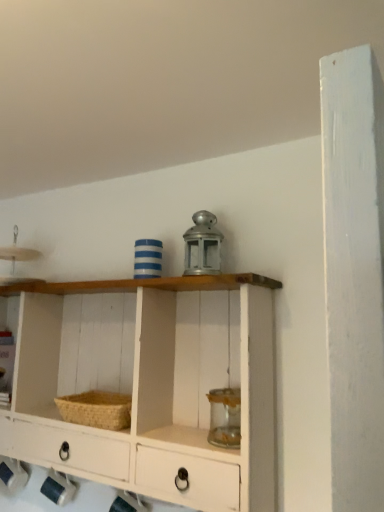
In order to face woven straw basket at lower left, should I rotate leftwards or rightwards?

Rotate left and turn 11.787 degrees.

What is the approximate width of woven straw basket at lower left?

7.54 inches.

This screenshot has height=512, width=384. In order to click on woven straw basket at lower left in this screenshot , I will do `click(97, 409)`.

This screenshot has width=384, height=512. What do you see at coordinates (97, 409) in the screenshot?
I see `woven straw basket at lower left` at bounding box center [97, 409].

What is the approximate height of white painted wood shelf at center?

24.24 inches.

The image size is (384, 512). Describe the element at coordinates (148, 384) in the screenshot. I see `white painted wood shelf at center` at that location.

Find the location of `white painted wood shelf at center`. white painted wood shelf at center is located at coordinates (148, 384).

Where is `woven straw basket at lower left`? woven straw basket at lower left is located at coordinates (97, 409).

Between woven straw basket at lower left and white painted wood shelf at center, which one appears on the left side from the viewer's perspective?

Positioned to the left is white painted wood shelf at center.

Between woven straw basket at lower left and white painted wood shelf at center, which one is positioned behind?

woven straw basket at lower left is further away from the camera.

Considering the positions of points (112, 420) and (177, 409), is point (112, 420) closer to camera compared to point (177, 409)?

Yes, it is in front of point (177, 409).

From the image's perspective, which object appears higher, woven straw basket at lower left or white painted wood shelf at center?

white painted wood shelf at center.

From a real-world perspective, who is located lower, woven straw basket at lower left or white painted wood shelf at center?

woven straw basket at lower left.

Looking at this image, can you confirm if woven straw basket at lower left is thinner than white painted wood shelf at center?

Correct, the width of woven straw basket at lower left is less than that of white painted wood shelf at center.

Is woven straw basket at lower left taller than white painted wood shelf at center?

In fact, woven straw basket at lower left may be shorter than white painted wood shelf at center.

Considering the sizes of objects woven straw basket at lower left and white painted wood shelf at center in the image provided, who is bigger, woven straw basket at lower left or white painted wood shelf at center?

white painted wood shelf at center.

Is white painted wood shelf at center completely or partially inside woven straw basket at lower left?

No, white painted wood shelf at center is not a part of woven straw basket at lower left.

Is woven straw basket at lower left not close to white painted wood shelf at center?

No, there isn't a large distance between woven straw basket at lower left and white painted wood shelf at center.

Does woven straw basket at lower left turn towards white painted wood shelf at center?

Yes, woven straw basket at lower left is aimed at white painted wood shelf at center.

How far apart are woven straw basket at lower left and white painted wood shelf at center?

woven straw basket at lower left is 7.86 inches from white painted wood shelf at center.

Identify the location of shelf that appears in front of the woven straw basket at lower left. This screenshot has width=384, height=512. pyautogui.click(x=148, y=384).

Would you say white painted wood shelf at center is to the left or to the right of woven straw basket at lower left in the picture?

Clearly, white painted wood shelf at center is on the left of woven straw basket at lower left in the image.

Which object is further away from the camera taking this photo, white painted wood shelf at center or woven straw basket at lower left?

woven straw basket at lower left is more distant.

Does point (267, 318) come behind point (96, 392)?

No.

From the image's perspective, is white painted wood shelf at center above or below woven straw basket at lower left?

white painted wood shelf at center is situated higher than woven straw basket at lower left in the image.

From a real-world perspective, is white painted wood shelf at center on woven straw basket at lower left?

Correct, in the physical world, white painted wood shelf at center is higher than woven straw basket at lower left.

Considering the sizes of objects white painted wood shelf at center and woven straw basket at lower left in the image provided, who is wider, white painted wood shelf at center or woven straw basket at lower left?

white painted wood shelf at center.

Who is shorter, white painted wood shelf at center or woven straw basket at lower left?

woven straw basket at lower left.

Is white painted wood shelf at center bigger than woven straw basket at lower left?

Correct, white painted wood shelf at center is larger in size than woven straw basket at lower left.

Is woven straw basket at lower left inside white painted wood shelf at center?

Yes, woven straw basket at lower left is a part of white painted wood shelf at center.

Is white painted wood shelf at center with woven straw basket at lower left?

white painted wood shelf at center and woven straw basket at lower left are not in contact.

Is woven straw basket at lower left at the back of white painted wood shelf at center?

Yes, white painted wood shelf at center is facing away from woven straw basket at lower left.

Consider the image. How distant is white painted wood shelf at center from woven straw basket at lower left?

white painted wood shelf at center is 7.86 inches from woven straw basket at lower left.

The image size is (384, 512). I want to click on basket below the white painted wood shelf at center (from a real-world perspective), so click(97, 409).

In the image, there is a woven straw basket at lower left. Where is `shelf above it (from the image's perspective)`? The width and height of the screenshot is (384, 512). shelf above it (from the image's perspective) is located at coordinates (148, 384).

Where is `basket located underneath the white painted wood shelf at center (from a real-world perspective)`? basket located underneath the white painted wood shelf at center (from a real-world perspective) is located at coordinates [x=97, y=409].